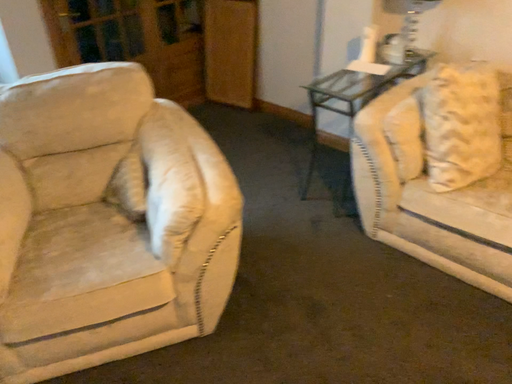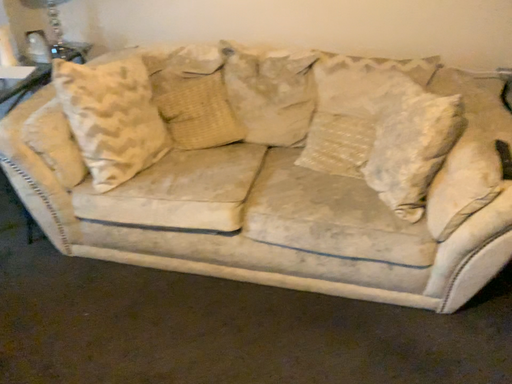
Question: How did the camera likely rotate when shooting the video?

Choices:
 (A) rotated left
 (B) rotated right

Answer: (B)